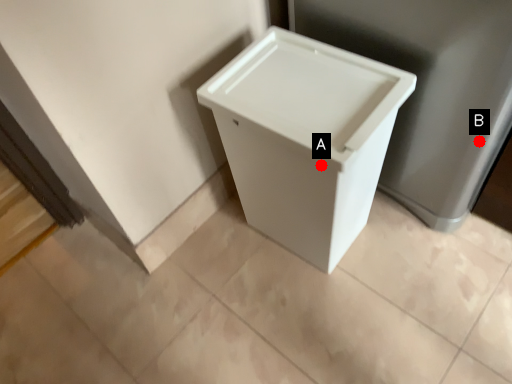
Question: Two points are circled on the image, labeled by A and B beside each circle. Which point is further to the camera?

Choices:
 (A) A is further
 (B) B is further

Answer: (B)